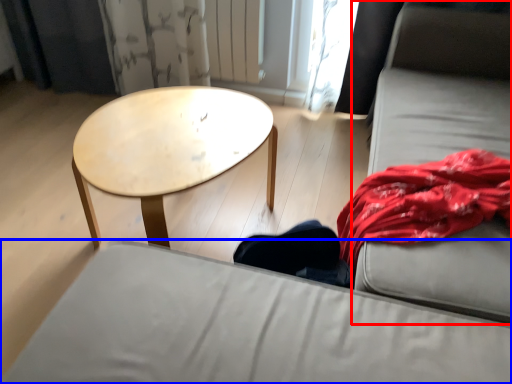
Question: Which object is further to the camera taking this photo, couch (highlighted by a red box) or studio couch (highlighted by a blue box)?

Choices:
 (A) couch
 (B) studio couch

Answer: (A)